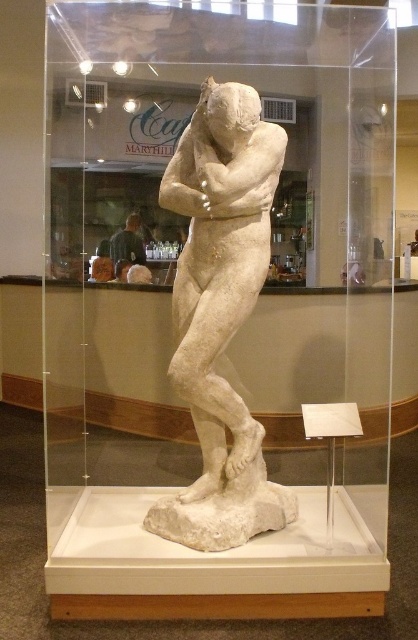
From the picture: You are an art conservator standing in front of the glass case. The museum has asked you to place a protective foam block at the exact center of the sculpture to prevent damage. Given that the glass case has a coordinate system where the bottom left corner is the origin, can you determine if the white marble statue at center is positioned at the exact center of the case?

The white marble statue at center is located at point (221, 314), which is very close to the center coordinates of the case. Therefore, placing the foam block at the statue would be appropriate as it is nearly centered.

You are a museum visitor who wants to take a photo of the white marble statue at center without the dark gray shirt at center appearing in the frame. Is it possible to do so given their distance?

The white marble statue at center and dark gray shirt at center are 3.31 meters apart, so yes, it is possible to take a photo of the white marble statue at center without the dark gray shirt at center appearing in the frame by positioning yourself appropriately to ensure the distance between them allows for a clear shot.

You are standing in front of the glass case containing the sculpture. There is a point marked at coordinates (221, 314). Can you tell me what this point is located on?

The point at coordinates (221, 314) is located on the white marble statue at center.